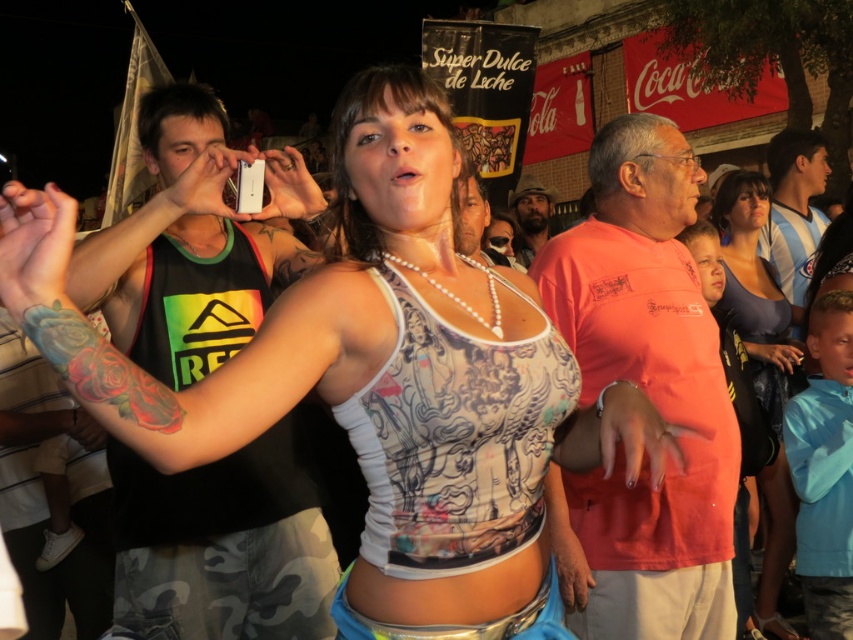
Question: Can you confirm if orange cotton shirt at center is wider than beige fabric hat at upper center?

Choices:
 (A) no
 (B) yes

Answer: (A)

Question: Which object is closer to the camera taking this photo?

Choices:
 (A) blue and white striped shirt at right
 (B) matte blue tank top at center

Answer: (B)

Question: Does orange cotton shirt at center appear on the right side of blue and white striped shirt at right?

Choices:
 (A) no
 (B) yes

Answer: (A)

Question: Which of the following is the farthest from the observer?

Choices:
 (A) beige fabric hat at upper center
 (B) black tank top at left
 (C) matte blue tank top at center

Answer: (A)

Question: Is black tank top at left further to camera compared to matte blue tank top at center?

Choices:
 (A) yes
 (B) no

Answer: (B)

Question: Which point is farther from the camera taking this photo?

Choices:
 (A) (312, 545)
 (B) (606, 168)

Answer: (B)